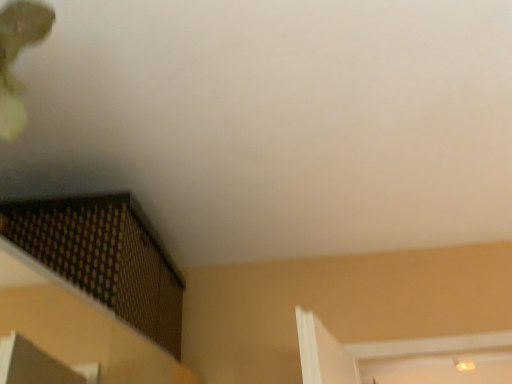
This screenshot has height=384, width=512. What do you see at coordinates (104, 257) in the screenshot?
I see `brown woven mat at upper left` at bounding box center [104, 257].

Locate an element on the screen. The height and width of the screenshot is (384, 512). brown woven mat at upper left is located at coordinates (104, 257).

In order to face brown woven mat at upper left, should I rotate leftwards or rightwards?

To align with it, rotate left about 22.129°.

The image size is (512, 384). Find the location of `brown woven mat at upper left`. brown woven mat at upper left is located at coordinates (104, 257).